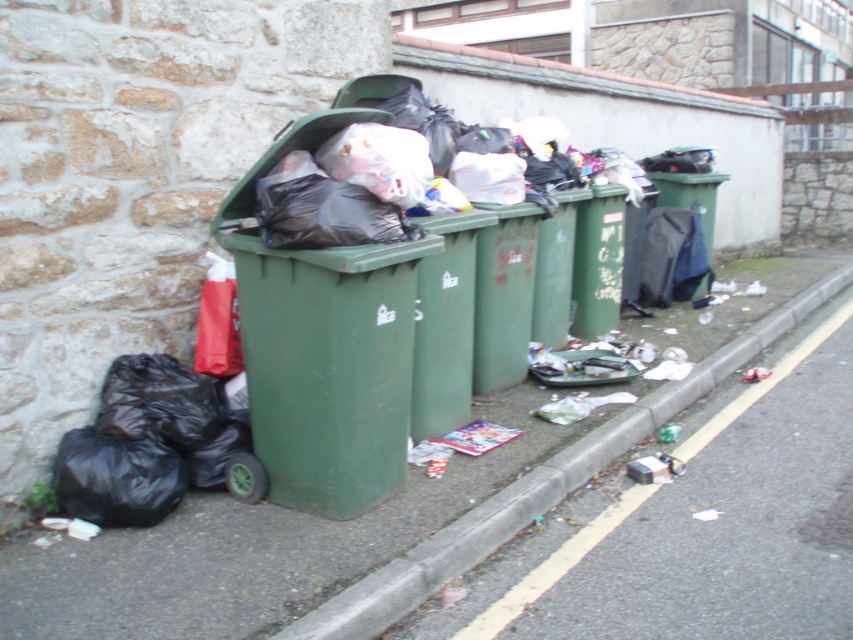
You are standing at the curb next to the recycling bins and want to walk to the point marked by point (515, 417). Which direction should you walk relative to point (347, 301)?

You should walk behind point (347, 301) because point (515, 417) is located behind it.

In the scene shown: You are a delivery person trying to navigate a narrow path between the green plastic pavement at lower left and the green plastic bin at left. Since you need to avoid hitting your delivery cart against anything, which one should you steer closer to?

You should steer closer to the green plastic pavement at lower left because it has a lesser height compared to the green plastic bin at left, reducing the risk of collision with your delivery cart.